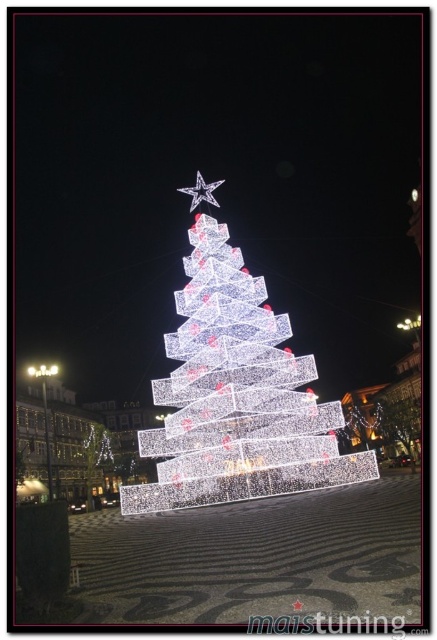
You are standing in front of the Christmas tree and notice two decorations. One is the illuminated wireframe at center and the other is the metallic silver star at upper center. Which decoration is positioned to the right of the other?

The illuminated wireframe at center is to the right of the metallic silver star at upper center.

You are standing at the base of the illuminated wireframe tree at center and want to place a new decoration at the same height as the metallic silver star at upper center. Given that the tree is 72.36 meters tall, can you reach the star without any equipment?

The distance between the illuminated wireframe tree at center and the metallic silver star at upper center is 72.36 meters. Since the tree itself is 72.36 meters tall, the star is at the very top. Therefore, you cannot reach the star without any equipment as it is at the top of the tree.